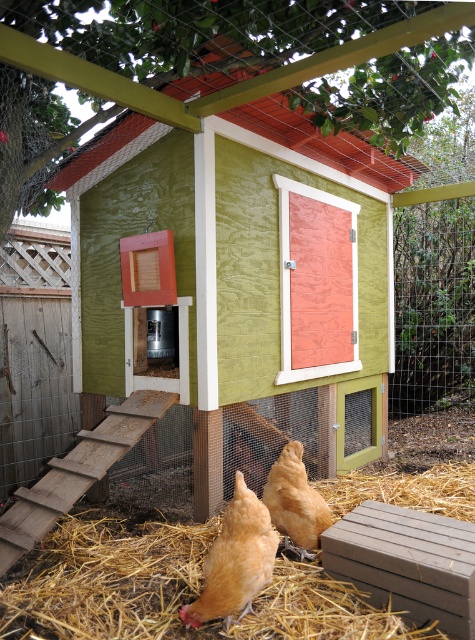
Is green plywood chicken coop at center thinner than yellow straw at lower center?

No.

Which is below, green plywood chicken coop at center or yellow straw at lower center?

yellow straw at lower center is lower down.

Where is `green plywood chicken coop at center`? The height and width of the screenshot is (640, 475). green plywood chicken coop at center is located at coordinates (240, 291).

Consider the image. Does golden feathered chicken at lower center have a greater height compared to golden feathered chicken at center?

Correct, golden feathered chicken at lower center is much taller as golden feathered chicken at center.

Where is `golden feathered chicken at lower center`? Image resolution: width=475 pixels, height=640 pixels. golden feathered chicken at lower center is located at coordinates (236, 561).

I want to click on golden feathered chicken at lower center, so pyautogui.click(x=236, y=561).

In the scene shown: Who is higher up, yellow straw at lower center or golden feathered chicken at center?

golden feathered chicken at center

Is point (348, 486) in front of point (298, 497)?

No, (348, 486) is behind (298, 497).

Between point (219, 520) and point (314, 500), which one is positioned behind?

The point (219, 520) is more distant.

Where is `yellow straw at lower center`? The height and width of the screenshot is (640, 475). yellow straw at lower center is located at coordinates (107, 579).